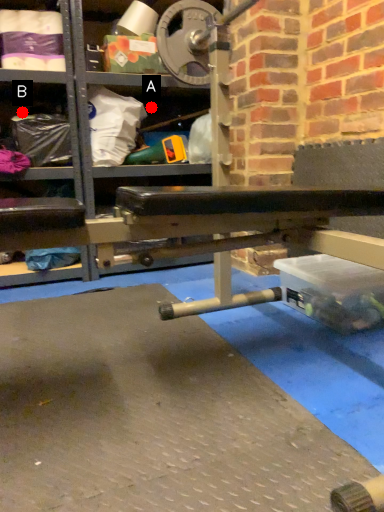
Question: Two points are circled on the image, labeled by A and B beside each circle. Which point is further to the camera?

Choices:
 (A) A is further
 (B) B is further

Answer: (A)